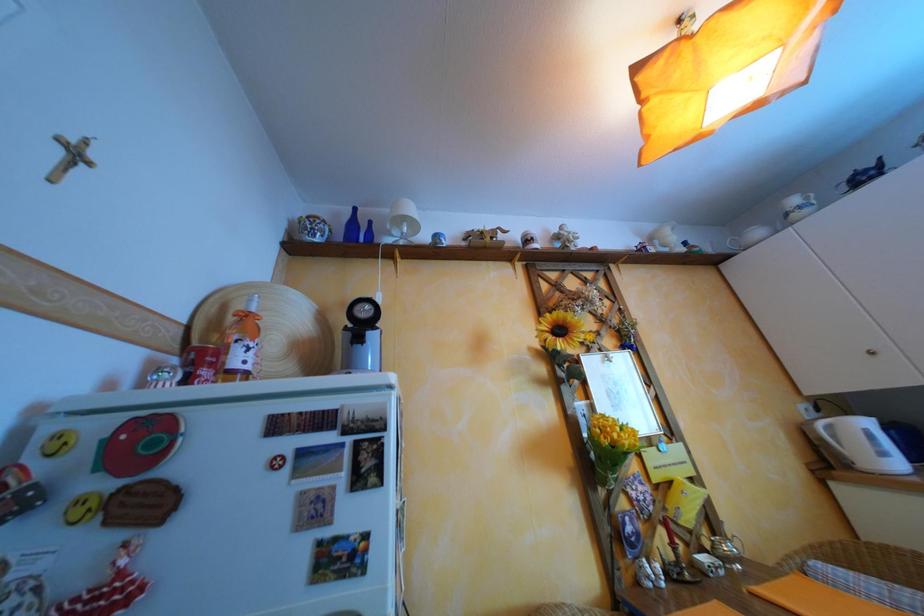
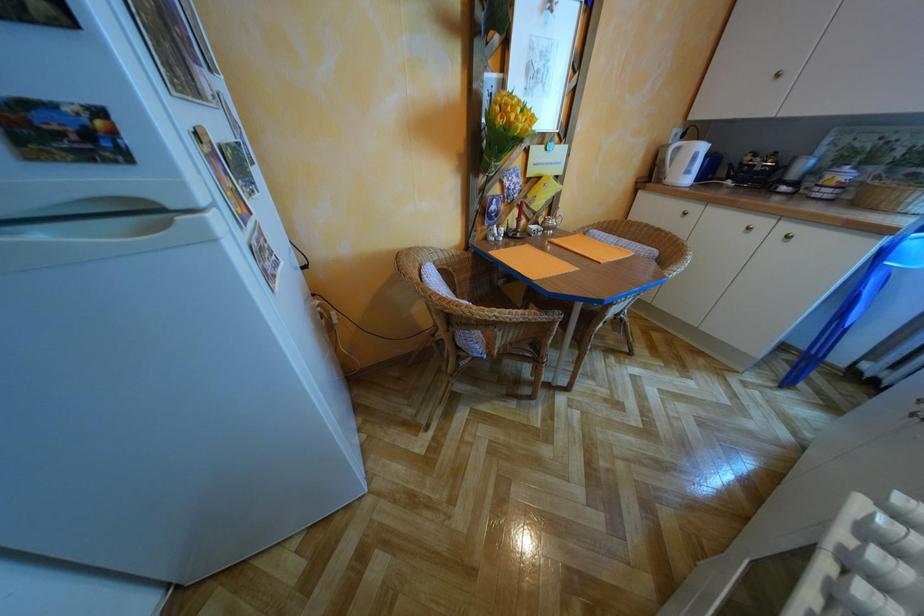
First-person continuous shooting, in which direction is the camera rotating?

The rotation direction of the camera is right-down.